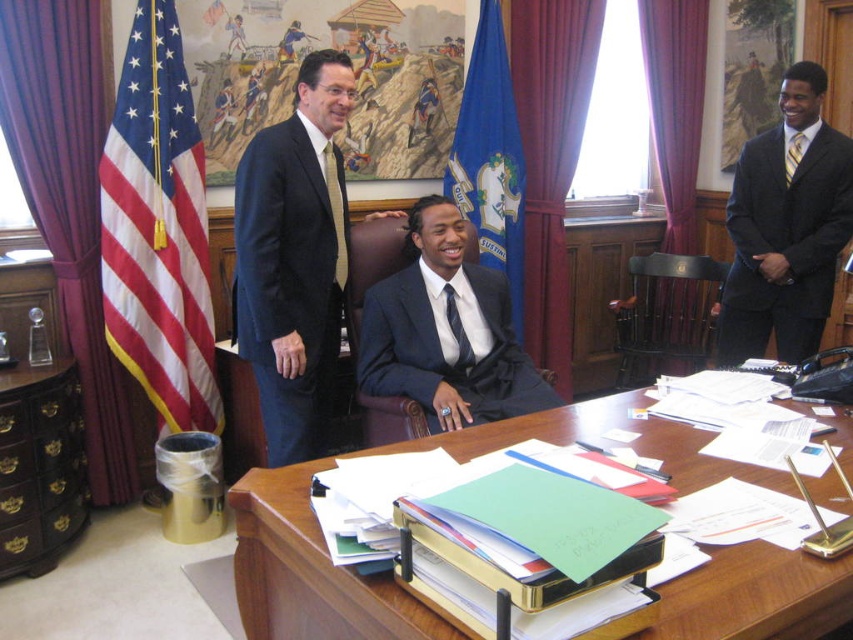
Question: From the image, what is the correct spatial relationship of red-white-striped flag at left in relation to yellow striped tie at center?

Choices:
 (A) above
 (B) below

Answer: (B)

Question: Which of these objects is positioned farthest from the red-white-striped flag at left?

Choices:
 (A) matte black suit at right
 (B) gold textured tie at center

Answer: (A)

Question: Does wooden desk at center appear under matte black suit at right?

Choices:
 (A) no
 (B) yes

Answer: (B)

Question: Which object is closer to the camera taking this photo?

Choices:
 (A) gold textured tie at center
 (B) dark blue wool suit at center
 (C) matte black suit at center

Answer: (B)

Question: Which point is farther to the camera?

Choices:
 (A) (454, 337)
 (B) (303, 474)
 (C) (792, 141)
 (D) (181, 426)

Answer: (C)

Question: Is dark blue wool suit at center positioned at the back of matte black suit at center?

Choices:
 (A) no
 (B) yes

Answer: (A)